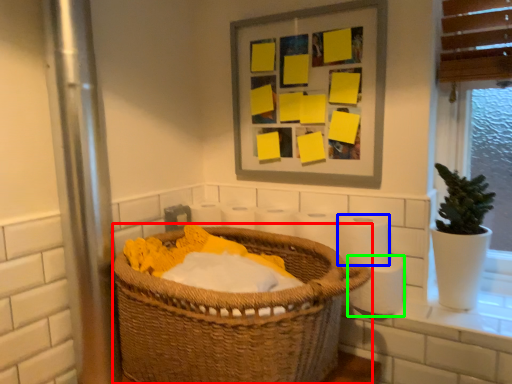
Question: Based on their relative distances, which object is farther from basket (highlighted by a red box)? Choose from toilet paper (highlighted by a blue box) and toilet paper (highlighted by a green box).

Choices:
 (A) toilet paper
 (B) toilet paper

Answer: (B)